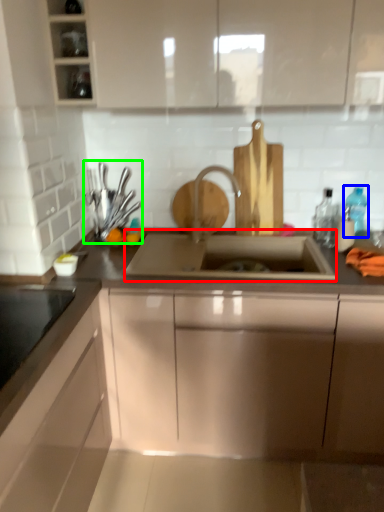
Question: Which object is positioned farthest from sink (highlighted by a red box)? Select from bottle (highlighted by a blue box) and appliance (highlighted by a green box).

Choices:
 (A) bottle
 (B) appliance

Answer: (A)